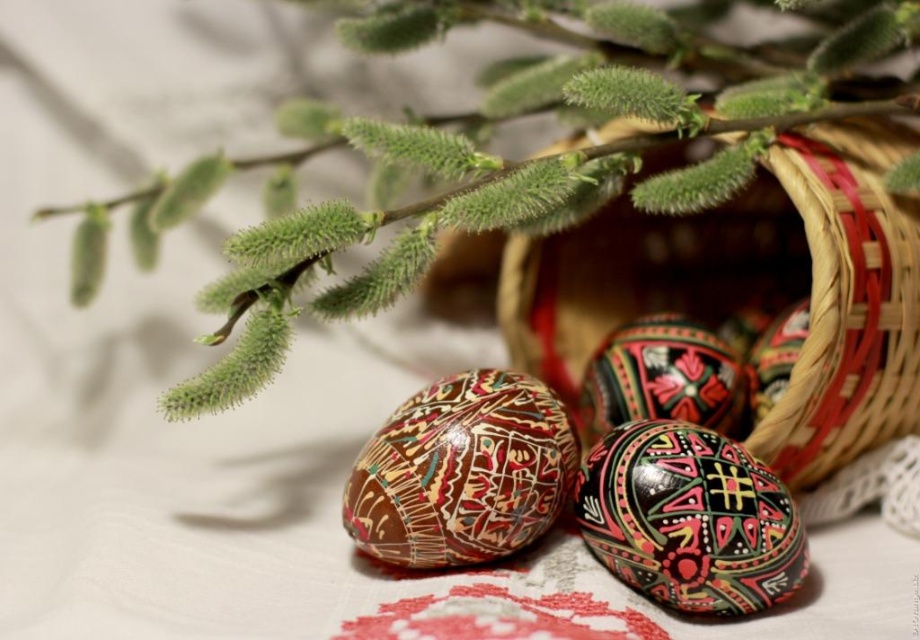
Question: Does brown glossy easter egg at center have a larger size compared to multicolored glossy easter egg at center?

Choices:
 (A) yes
 (B) no

Answer: (A)

Question: Is brown woven basket at center below brown glossy easter egg at center?

Choices:
 (A) no
 (B) yes

Answer: (A)

Question: Which object is the farthest from the brown woven basket at center?

Choices:
 (A) green fuzzy branch at upper center
 (B) multicolored glossy egg at center
 (C) multicolored glossy easter egg at center
 (D) brown glossy easter egg at center

Answer: (D)

Question: Which object is positioned farthest from the green fuzzy branch at upper center?

Choices:
 (A) brown woven basket at center
 (B) multicolored glossy easter egg at center
 (C) brown glossy easter egg at center
 (D) multicolored glossy egg at center

Answer: (D)

Question: Is brown glossy easter egg at center closer to camera compared to multicolored glossy egg at center?

Choices:
 (A) yes
 (B) no

Answer: (B)

Question: Which point is closer to the camera?

Choices:
 (A) multicolored glossy egg at center
 (B) brown glossy easter egg at center

Answer: (A)